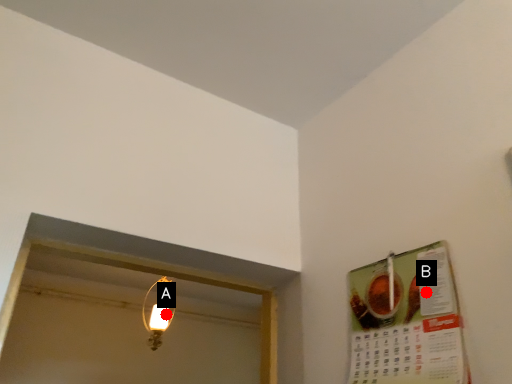
Question: Two points are circled on the image, labeled by A and B beside each circle. Which point appears closest to the camera in this image?

Choices:
 (A) A is closer
 (B) B is closer

Answer: (B)